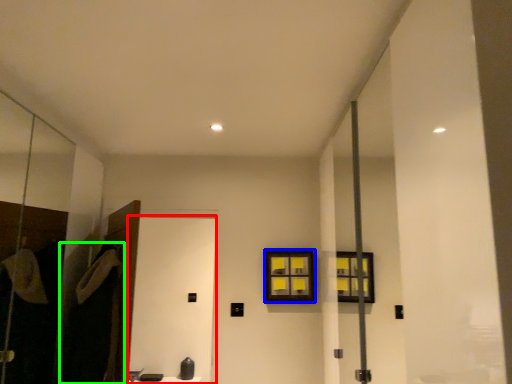
Question: Based on their relative distances, which object is nearer to screen door (highlighted by a red box)? Choose from window (highlighted by a blue box) and robe (highlighted by a green box).

Choices:
 (A) window
 (B) robe

Answer: (A)